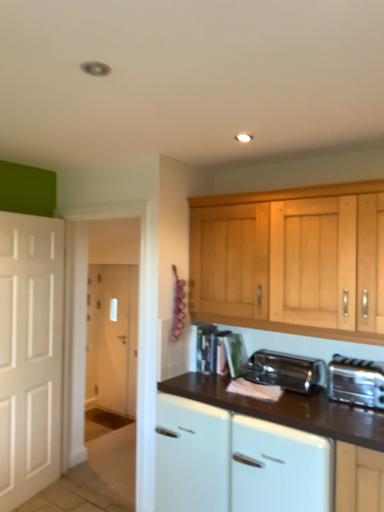
Question: Is satin chrome toaster at lower center spatially inside silver metallic toaster at lower right, or outside of it?

Choices:
 (A) outside
 (B) inside

Answer: (A)

Question: Based on their sizes in the image, would you say satin chrome toaster at lower center is bigger or smaller than silver metallic toaster at lower right?

Choices:
 (A) small
 (B) big

Answer: (B)

Question: Which of these objects is positioned closest to the silver metallic toaster at lower right?

Choices:
 (A) white glossy dishwasher at lower center
 (B) white glossy cabinet at center
 (C) satin chrome toaster at lower center

Answer: (C)

Question: Estimate the real-world distances between objects in this image. Which object is farther from the white glossy cabinet at center?

Choices:
 (A) satin chrome toaster at lower center
 (B) white glossy dishwasher at lower center
 (C) silver metallic toaster at lower right

Answer: (C)